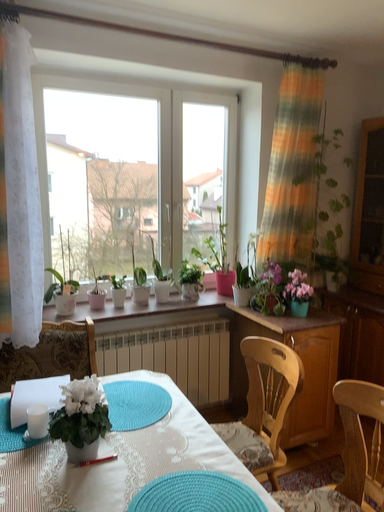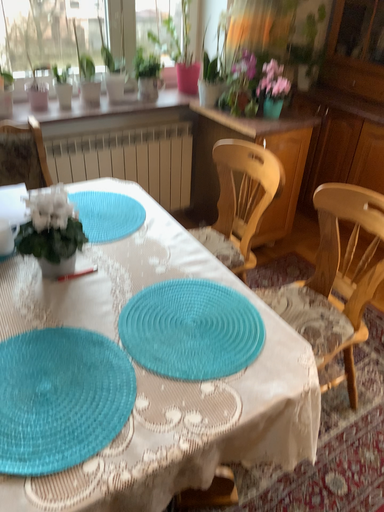
Question: Which way did the camera rotate in the video?

Choices:
 (A) rotated upward
 (B) rotated downward

Answer: (B)